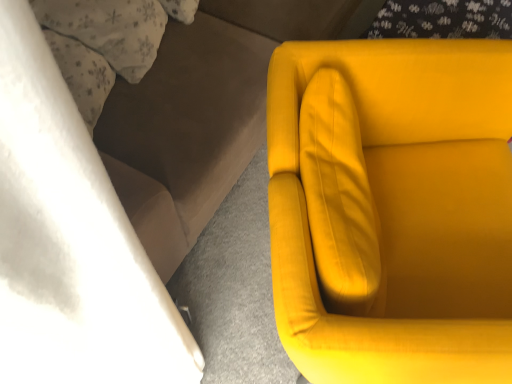
Question: Considering the relative sizes of matte yellow armchair at right and velvet yellow couch at right in the image provided, is matte yellow armchair at right wider than velvet yellow couch at right?

Choices:
 (A) yes
 (B) no

Answer: (B)

Question: Is matte yellow armchair at right facing towards velvet yellow couch at right?

Choices:
 (A) yes
 (B) no

Answer: (B)

Question: From a real-world perspective, does matte yellow armchair at right sit lower than velvet yellow couch at right?

Choices:
 (A) yes
 (B) no

Answer: (A)

Question: Considering the relative positions of matte yellow armchair at right and velvet yellow couch at right in the image provided, is matte yellow armchair at right in front of velvet yellow couch at right?

Choices:
 (A) no
 (B) yes

Answer: (B)

Question: Is matte yellow armchair at right bigger than velvet yellow couch at right?

Choices:
 (A) no
 (B) yes

Answer: (A)

Question: Is matte yellow armchair at right looking in the opposite direction of velvet yellow couch at right?

Choices:
 (A) no
 (B) yes

Answer: (B)

Question: Is velvet yellow couch at right behind matte yellow armchair at right?

Choices:
 (A) no
 (B) yes

Answer: (B)

Question: Is velvet yellow couch at right at the right side of matte yellow armchair at right?

Choices:
 (A) no
 (B) yes

Answer: (A)

Question: From the image's perspective, is velvet yellow couch at right above matte yellow armchair at right?

Choices:
 (A) no
 (B) yes

Answer: (B)

Question: From a real-world perspective, does velvet yellow couch at right sit lower than matte yellow armchair at right?

Choices:
 (A) no
 (B) yes

Answer: (A)

Question: From the image's perspective, does velvet yellow couch at right appear lower than matte yellow armchair at right?

Choices:
 (A) no
 (B) yes

Answer: (A)

Question: Is matte yellow armchair at right completely or partially inside velvet yellow couch at right?

Choices:
 (A) yes
 (B) no

Answer: (B)

Question: Is point (200, 201) closer or farther from the camera than point (292, 132)?

Choices:
 (A) closer
 (B) farther

Answer: (B)